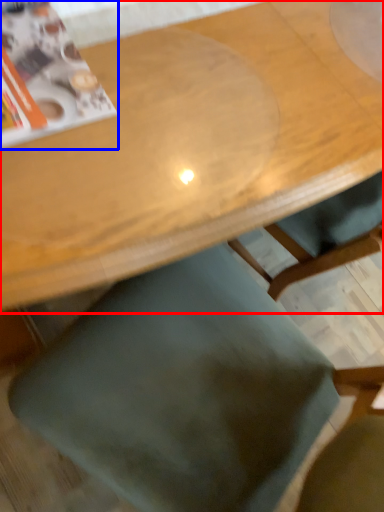
Question: Which object appears closest to the camera in this image, table (highlighted by a red box) or magazine (highlighted by a blue box)?

Choices:
 (A) table
 (B) magazine

Answer: (A)